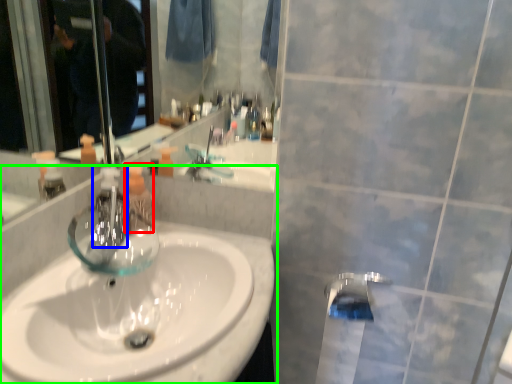
Question: Which object is the farthest from mouthwash (highlighted by a red box)? Choose among these: faucet (highlighted by a blue box) or sink (highlighted by a green box).

Choices:
 (A) faucet
 (B) sink

Answer: (B)